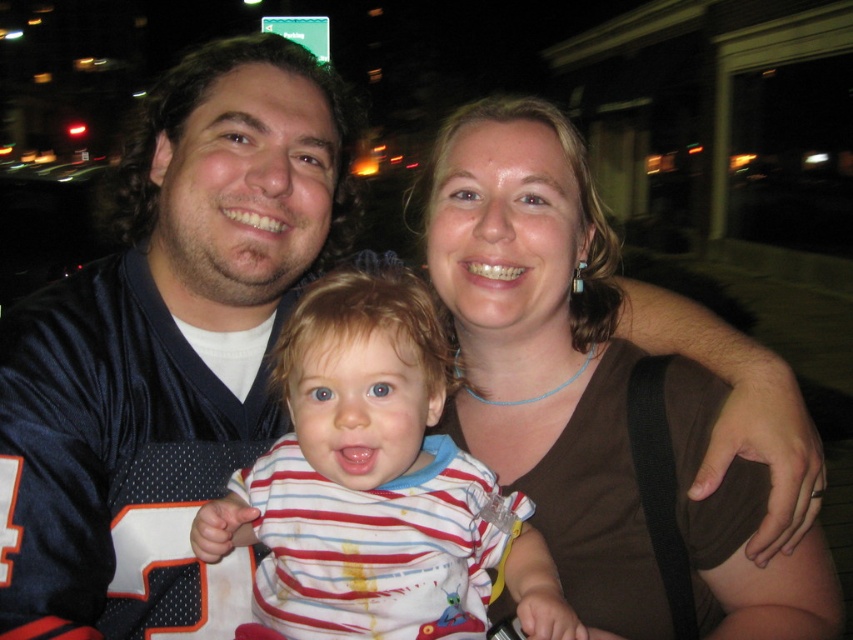
Question: Can you confirm if brown fabric shirt at upper right is positioned to the left of striped cotton shirt at center?

Choices:
 (A) yes
 (B) no

Answer: (B)

Question: Which object appears closest to the camera in this image?

Choices:
 (A) striped cotton shirt at center
 (B) brown fabric shirt at upper right

Answer: (A)

Question: Which object appears closest to the camera in this image?

Choices:
 (A) striped cotton shirt at center
 (B) brown fabric shirt at upper right

Answer: (A)

Question: Which point is closer to the camera taking this photo?

Choices:
 (A) (592, 541)
 (B) (424, 310)

Answer: (B)

Question: Does brown fabric shirt at upper right have a larger size compared to striped cotton shirt at center?

Choices:
 (A) yes
 (B) no

Answer: (A)

Question: Is brown fabric shirt at upper right wider than striped cotton shirt at center?

Choices:
 (A) yes
 (B) no

Answer: (A)